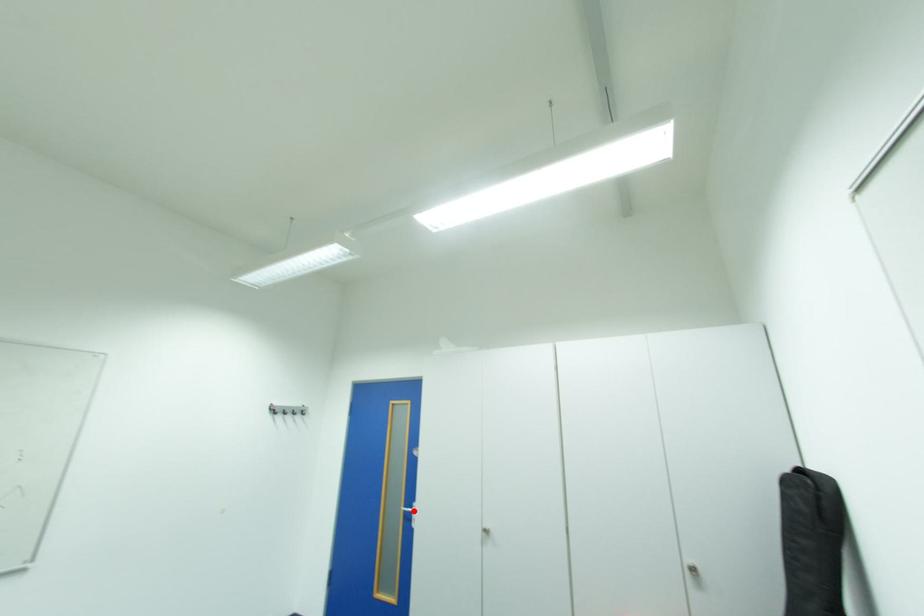
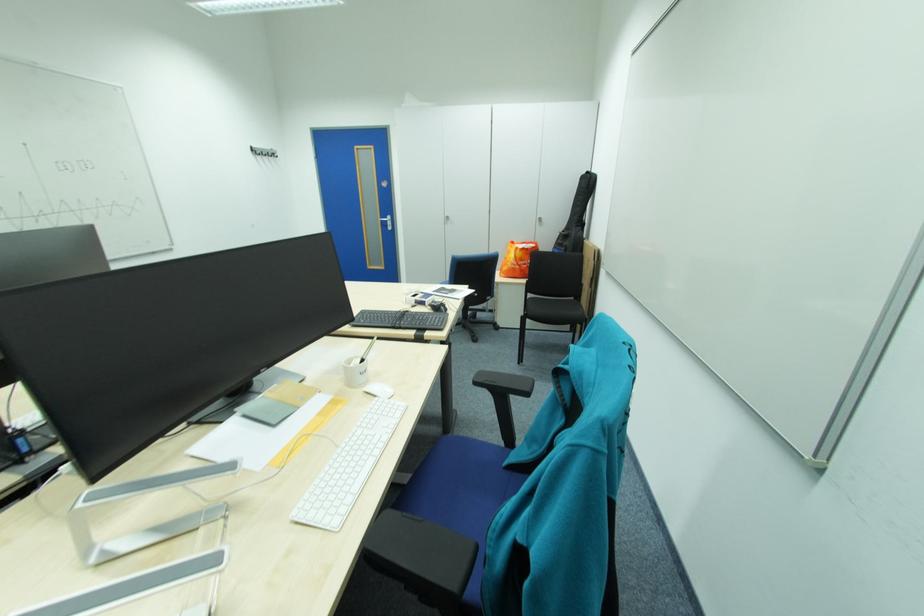
Where in the second image is the point corresponding to the highlighted location from the first image?

(390, 221)